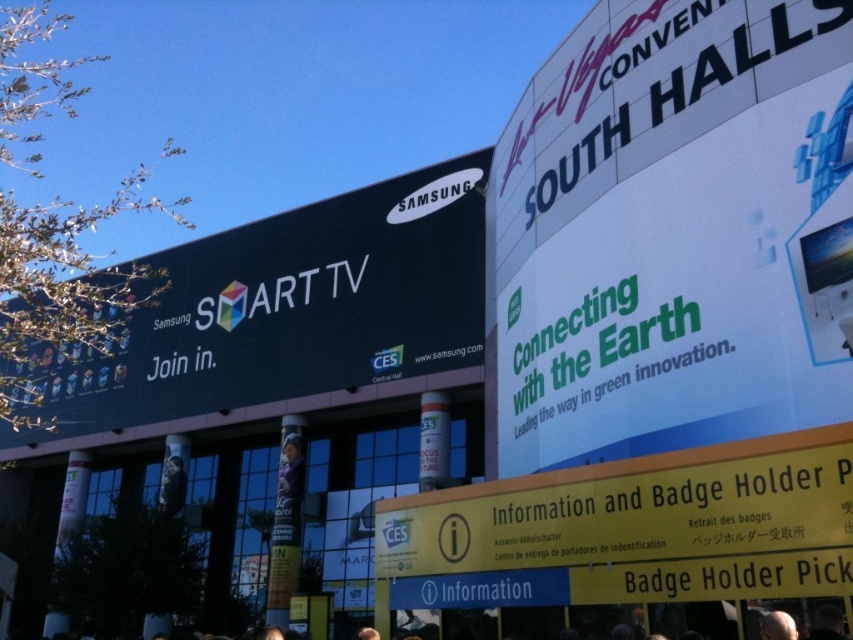
Which is behind, point (453, 342) or point (451, 611)?

The point (453, 342) is behind.

Can you confirm if black matte sign at upper left is positioned above dark gray hair at lower center?

Indeed, black matte sign at upper left is positioned over dark gray hair at lower center.

The height and width of the screenshot is (640, 853). In order to click on black matte sign at upper left in this screenshot , I will do `click(291, 308)`.

Does point (659, 628) come in front of point (814, 627)?

That is False.

Measure the distance between dark gray hair at lower center and dark hair at lower right.

A distance of 3.11 meters exists between dark gray hair at lower center and dark hair at lower right.

Image resolution: width=853 pixels, height=640 pixels. Describe the element at coordinates (691, 620) in the screenshot. I see `dark gray hair at lower center` at that location.

The width and height of the screenshot is (853, 640). Find the location of `dark gray hair at lower center`. dark gray hair at lower center is located at coordinates (691, 620).

Does black matte sign at upper left have a smaller size compared to dark hair at lower right?

Incorrect, black matte sign at upper left is not smaller in size than dark hair at lower right.

From the picture: Does black matte sign at upper left come behind dark hair at lower right?

Yes, it is behind dark hair at lower right.

Between point (431, 294) and point (831, 611), which one is positioned in front?

Point (831, 611)

This screenshot has height=640, width=853. In order to click on black matte sign at upper left in this screenshot , I will do `click(291, 308)`.